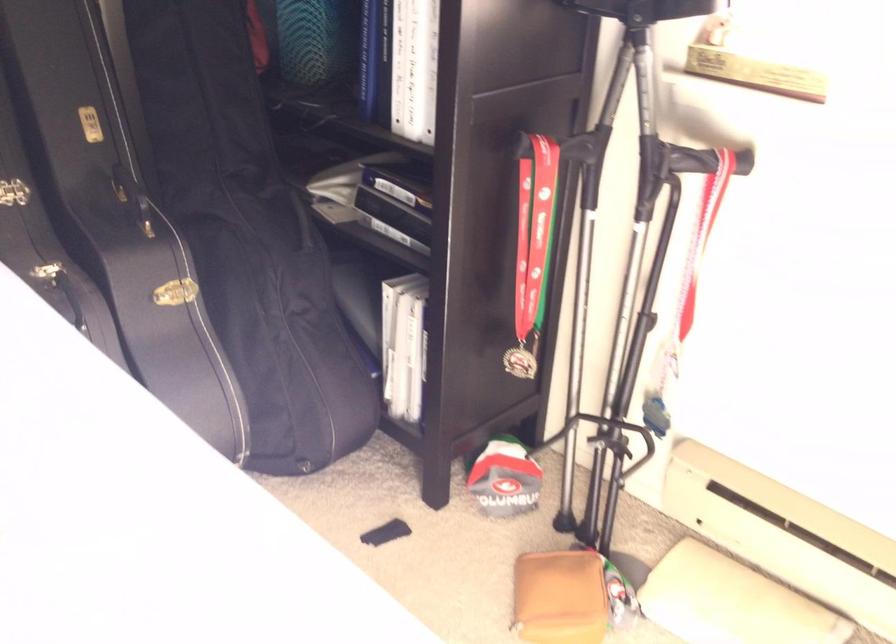
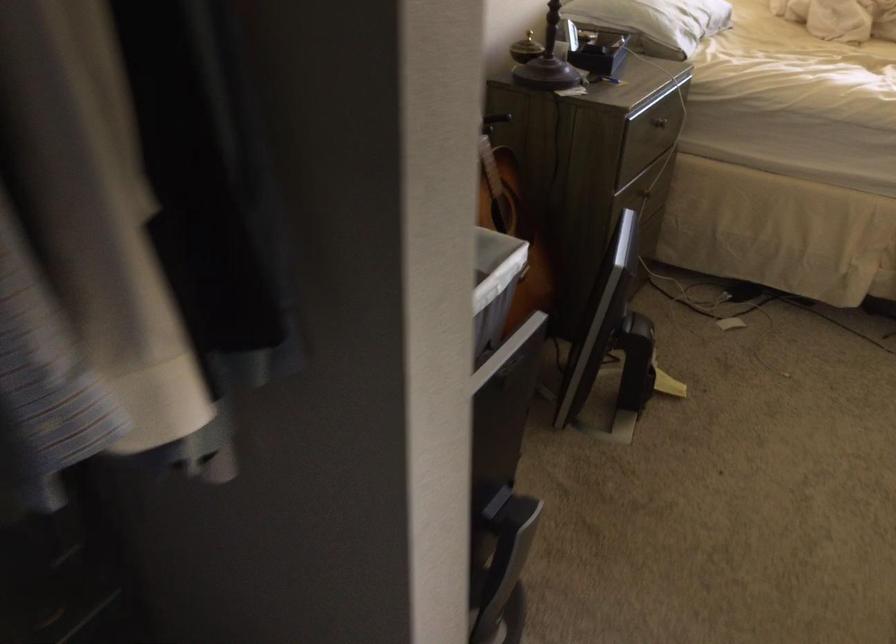
Which direction would the cameraman need to move to produce the second image?

The cameraman walked toward left, backward.